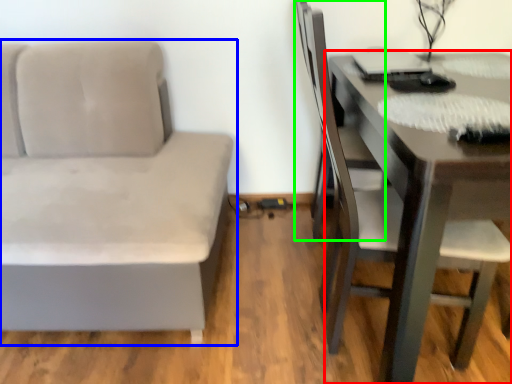
Question: Which is nearer to the table (highlighted by a red box)? studio couch (highlighted by a blue box) or swivel chair (highlighted by a green box).

Choices:
 (A) studio couch
 (B) swivel chair

Answer: (B)